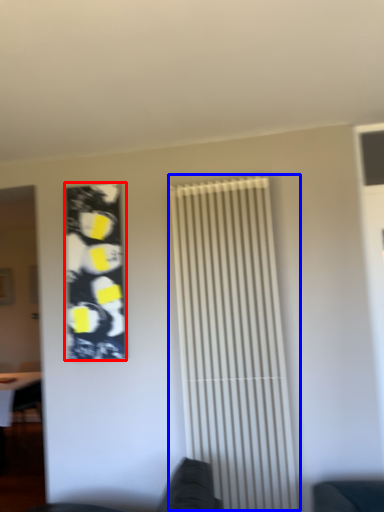
Question: Among these objects, which one is farthest to the camera, poster (highlighted by a red box) or shutter (highlighted by a blue box)?

Choices:
 (A) poster
 (B) shutter

Answer: (A)